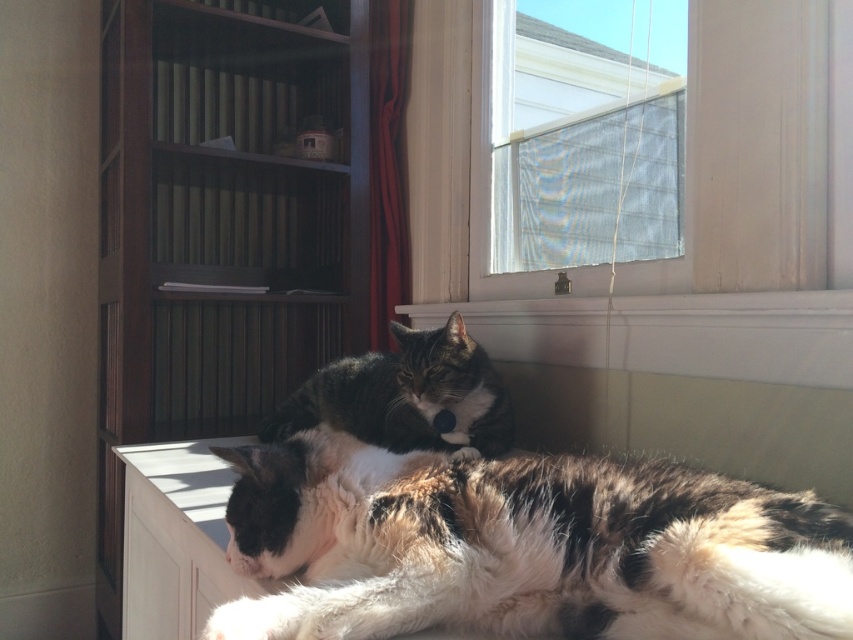
Is wooden bookshelf at left wider than translucent fabric at upper center?

Indeed, wooden bookshelf at left has a greater width compared to translucent fabric at upper center.

Which is below, wooden bookshelf at left or translucent fabric at upper center?

wooden bookshelf at left is below.

Where is `wooden bookshelf at left`? wooden bookshelf at left is located at coordinates (222, 221).

Which of these two, wooden bookshelf at left or velvet-like red curtain at center, stands taller?

With more height is wooden bookshelf at left.

Is wooden bookshelf at left shorter than velvet-like red curtain at center?

No, wooden bookshelf at left is not shorter than velvet-like red curtain at center.

I want to click on wooden bookshelf at left, so click(222, 221).

Describe the element at coordinates (524, 547) in the screenshot. This screenshot has width=853, height=640. I see `calico fur cat at lower center` at that location.

Is calico fur cat at lower center in front of translucent fabric at upper center?

Yes.

Between point (697, 532) and point (648, 202), which one is positioned behind?

Positioned behind is point (648, 202).

Find the location of a particular element. calico fur cat at lower center is located at coordinates tap(524, 547).